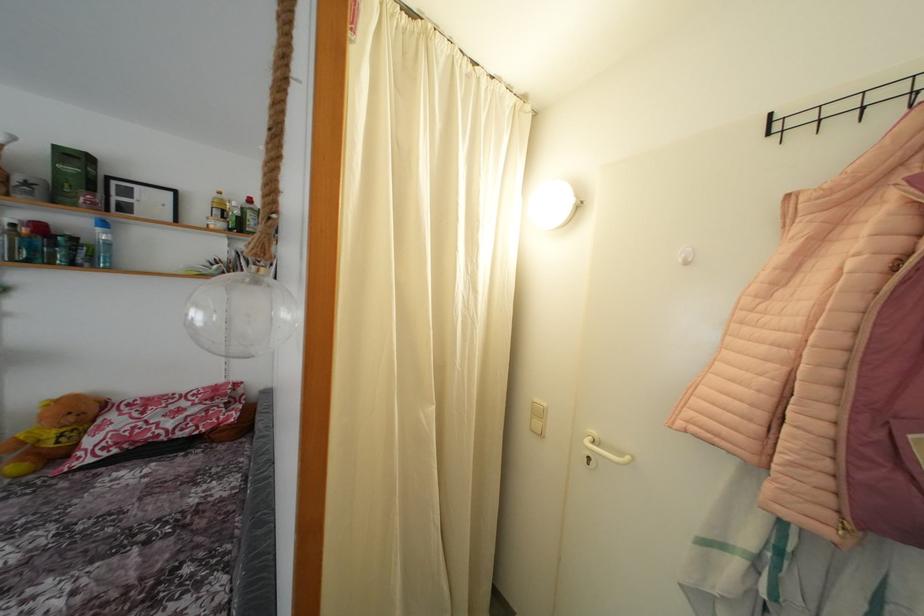
Find where to press the white light switch. Please return your answer as a coordinate pair (x, y).

(537, 418)